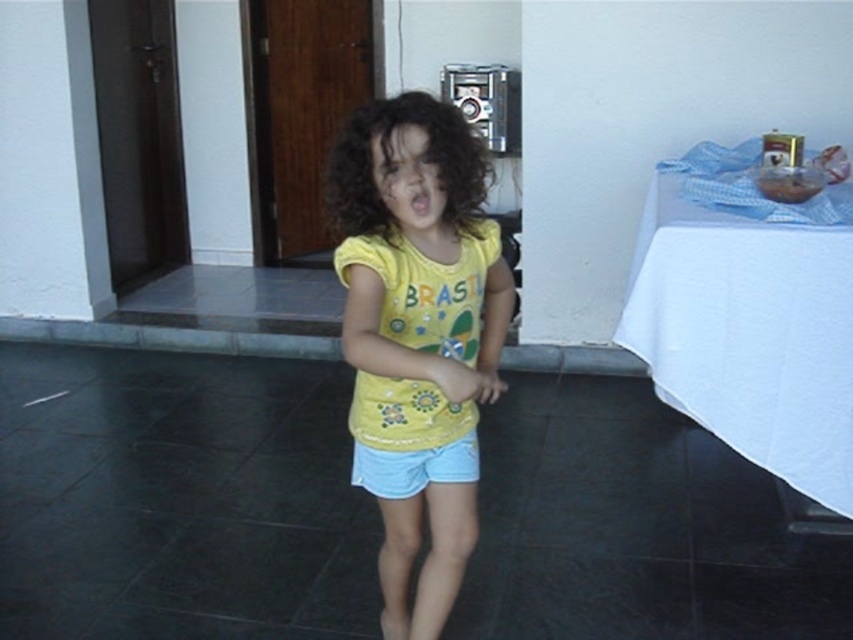
Between point (399, 305) and point (769, 348), which one is positioned behind?

Point (769, 348)

Who is positioned more to the right, yellow cotton shirt at center or white cloth at right?

Positioned to the right is white cloth at right.

Find the location of `yellow cotton shirt at center`. yellow cotton shirt at center is located at coordinates (416, 333).

Is curly brown hair at center positioned in front of light blue denim shorts at center?

Yes, it is in front of light blue denim shorts at center.

Is curly brown hair at center to the right of light blue denim shorts at center from the viewer's perspective?

Incorrect, curly brown hair at center is not on the right side of light blue denim shorts at center.

This screenshot has height=640, width=853. What do you see at coordinates (390, 161) in the screenshot?
I see `curly brown hair at center` at bounding box center [390, 161].

The height and width of the screenshot is (640, 853). Identify the location of curly brown hair at center. point(390,161).

Does point (361, 148) come behind point (358, 198)?

No.

Can you confirm if yellow cotton shirt at center is smaller than curly brown hair at center?

Incorrect, yellow cotton shirt at center is not smaller in size than curly brown hair at center.

Is point (463, 221) closer to camera compared to point (376, 189)?

That is False.

This screenshot has height=640, width=853. In order to click on yellow cotton shirt at center in this screenshot , I will do click(416, 333).